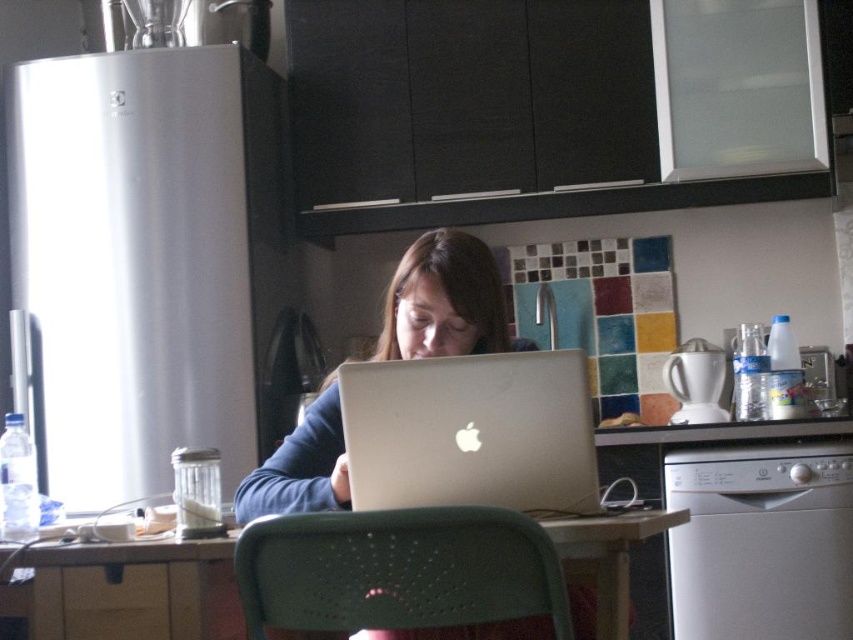
Between point (148, 609) and point (386, 305), which one is positioned behind?

The point (386, 305) is behind.

Consider the image. Does wooden table at center appear on the right side of matte silver laptop at center?

No, wooden table at center is not to the right of matte silver laptop at center.

This screenshot has height=640, width=853. What do you see at coordinates (131, 589) in the screenshot? I see `wooden table at center` at bounding box center [131, 589].

Locate an element on the screen. The width and height of the screenshot is (853, 640). wooden table at center is located at coordinates (131, 589).

Does green perforated chair at center have a greater height compared to matte silver laptop at center?

In fact, green perforated chair at center may be shorter than matte silver laptop at center.

Is point (398, 628) less distant than point (316, 488)?

Yes, point (398, 628) is in front of point (316, 488).

The image size is (853, 640). Describe the element at coordinates (397, 570) in the screenshot. I see `green perforated chair at center` at that location.

At what (x,y) coordinates should I click in order to perform the action: click on green perforated chair at center. Please return your answer as a coordinate pair (x, y). The image size is (853, 640). Looking at the image, I should click on (397, 570).

Who is lower down, green perforated chair at center or wooden table at center?

wooden table at center is below.

Does point (254, 541) come farther from viewer compared to point (233, 612)?

No, (254, 541) is closer to viewer.

Who is more distant from viewer, (306, 620) or (39, 561)?

The point (39, 561) is more distant.

Where is `green perforated chair at center`? The height and width of the screenshot is (640, 853). green perforated chair at center is located at coordinates (397, 570).